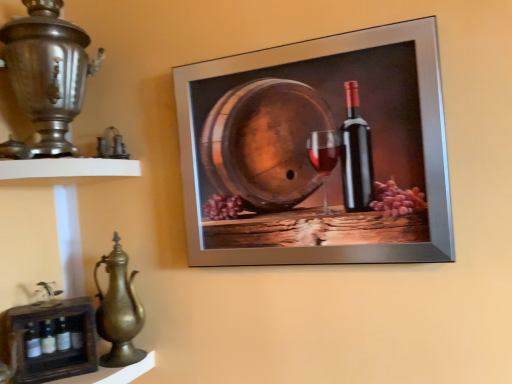
Question: Would you say metallic silver frame at upper center contains white matte shelf at left, marked as the first shelf in a top-to-bottom arrangement?

Choices:
 (A) no
 (B) yes

Answer: (A)

Question: Is metallic silver frame at upper center positioned in front of white matte shelf at left, the second shelf positioned from the bottom?

Choices:
 (A) yes
 (B) no

Answer: (B)

Question: From the image's perspective, is metallic silver frame at upper center over white matte shelf at left, the second shelf positioned from the bottom?

Choices:
 (A) no
 (B) yes

Answer: (B)

Question: Is metallic silver frame at upper center bigger than white matte shelf at left, marked as the first shelf in a top-to-bottom arrangement?

Choices:
 (A) yes
 (B) no

Answer: (A)

Question: Does metallic silver frame at upper center have a greater width compared to white matte shelf at left, marked as the first shelf in a top-to-bottom arrangement?

Choices:
 (A) no
 (B) yes

Answer: (A)

Question: From a real-world perspective, is metallic silver frame at upper center positioned over white matte shelf at left, marked as the first shelf in a top-to-bottom arrangement, based on gravity?

Choices:
 (A) yes
 (B) no

Answer: (B)

Question: Is metallic silver frame at upper center bigger than polished silver samovar at left?

Choices:
 (A) no
 (B) yes

Answer: (A)

Question: Is metallic silver frame at upper center smaller than polished silver samovar at left?

Choices:
 (A) no
 (B) yes

Answer: (B)

Question: Would you consider metallic silver frame at upper center to be distant from polished silver samovar at left?

Choices:
 (A) yes
 (B) no

Answer: (B)

Question: Is metallic silver frame at upper center oriented away from polished silver samovar at left?

Choices:
 (A) yes
 (B) no

Answer: (B)

Question: From a real-world perspective, is metallic silver frame at upper center located higher than polished silver samovar at left?

Choices:
 (A) no
 (B) yes

Answer: (A)

Question: Is the depth of metallic silver frame at upper center greater than that of polished silver samovar at left?

Choices:
 (A) yes
 (B) no

Answer: (A)

Question: Does wooden crate at lower left, which appears as the 1th shelf when ordered from the bottom, come behind metallic silver frame at upper center?

Choices:
 (A) no
 (B) yes

Answer: (B)